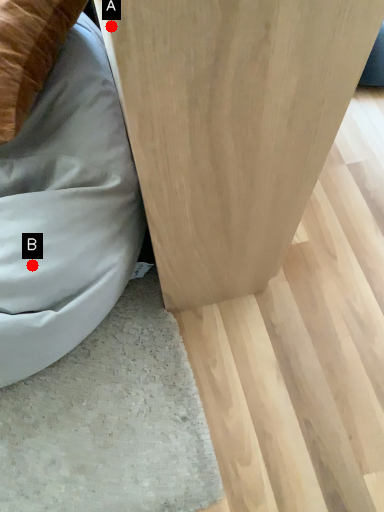
Question: Two points are circled on the image, labeled by A and B beside each circle. Which point is closer to the camera?

Choices:
 (A) A is closer
 (B) B is closer

Answer: (A)